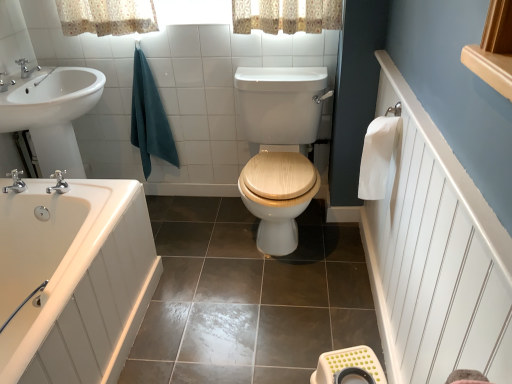
Question: Can you confirm if teal cotton towel at upper left, marked as the first bath towel in a back-to-front arrangement, is shorter than white plastic stool at lower right?

Choices:
 (A) no
 (B) yes

Answer: (A)

Question: Is teal cotton towel at upper left, which appears as the second bath towel when viewed from the front, wider than white plastic stool at lower right?

Choices:
 (A) yes
 (B) no

Answer: (B)

Question: Is there a large distance between teal cotton towel at upper left, which appears as the second bath towel when viewed from the front, and white plastic stool at lower right?

Choices:
 (A) yes
 (B) no

Answer: (A)

Question: Is teal cotton towel at upper left, arranged as the 2th bath towel when viewed from the right, aimed at white plastic stool at lower right?

Choices:
 (A) no
 (B) yes

Answer: (A)

Question: From the image's perspective, is teal cotton towel at upper left, which appears as the second bath towel when viewed from the front, beneath white plastic stool at lower right?

Choices:
 (A) no
 (B) yes

Answer: (A)

Question: Is teal cotton towel at upper left, acting as the 1th bath towel starting from the left, further to camera compared to white plastic stool at lower right?

Choices:
 (A) no
 (B) yes

Answer: (B)

Question: From a real-world perspective, is brushed metal faucet at upper left, which ranks as the 3th tap in bottom-to-top order, on top of white glossy bathtub at lower left?

Choices:
 (A) no
 (B) yes

Answer: (B)

Question: From the image's perspective, is brushed metal faucet at upper left, which is the third tap in front-to-back order, on top of white glossy bathtub at lower left?

Choices:
 (A) no
 (B) yes

Answer: (B)

Question: Is brushed metal faucet at upper left, which is the third tap in front-to-back order, facing towards white glossy bathtub at lower left?

Choices:
 (A) yes
 (B) no

Answer: (B)

Question: Is brushed metal faucet at upper left, which is the third tap in front-to-back order, positioned beyond the bounds of white glossy bathtub at lower left?

Choices:
 (A) yes
 (B) no

Answer: (A)

Question: From a real-world perspective, is brushed metal faucet at upper left, the 1th tap when ordered from back to front, located beneath white glossy bathtub at lower left?

Choices:
 (A) no
 (B) yes

Answer: (A)

Question: Is white glossy bathtub at lower left completely or partially inside brushed metal faucet at upper left, which ranks as the 1th tap in top-to-bottom order?

Choices:
 (A) no
 (B) yes

Answer: (A)

Question: Is white paper towel at right, which ranks as the 1th bath towel in front-to-back order, bigger than silver metallic faucet at upper left, which is the 2th tap in bottom-to-top order?

Choices:
 (A) no
 (B) yes

Answer: (B)